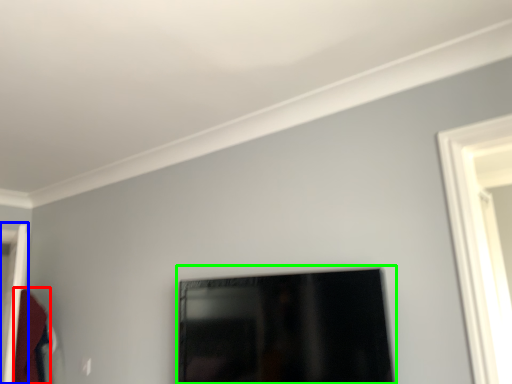
Question: Estimate the real-world distances between objects in this image. Which object is closer to robe (highlighted by a red box), door (highlighted by a blue box) or picture frame (highlighted by a green box)?

Choices:
 (A) door
 (B) picture frame

Answer: (A)